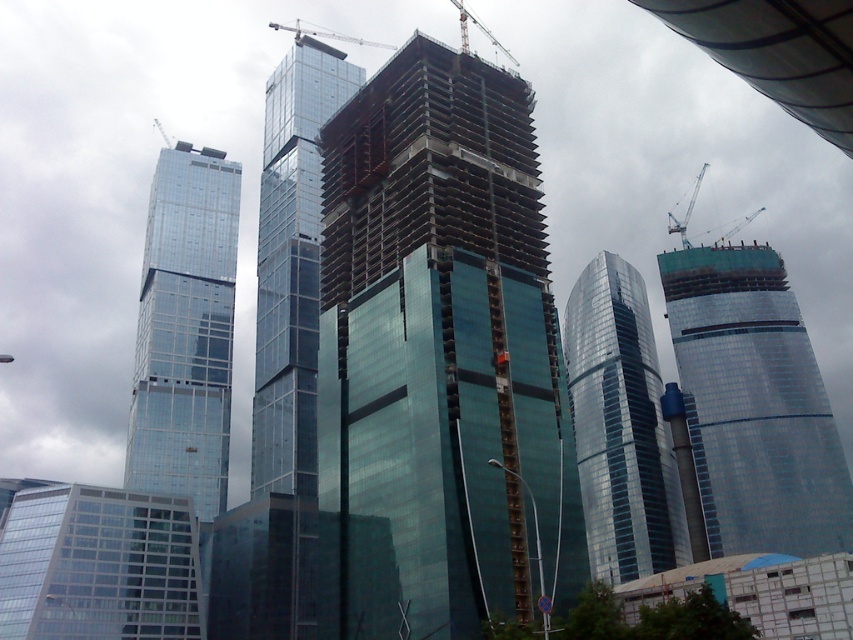
Between green glass building at center and glassy steel skyscraper at center, which one appears on the left side from the viewer's perspective?

From the viewer's perspective, glassy steel skyscraper at center appears more on the left side.

Is green glass building at center shorter than glassy steel skyscraper at center?

Indeed, green glass building at center has a lesser height compared to glassy steel skyscraper at center.

The width and height of the screenshot is (853, 640). Identify the location of green glass building at center. (438, 358).

Is clear glass building at lower left further to the viewer compared to metallic gray crane at upper right?

No.

Is clear glass building at lower left thinner than metallic gray crane at upper right?

No.

Where is `clear glass building at lower left`? This screenshot has height=640, width=853. clear glass building at lower left is located at coordinates [x=97, y=563].

Locate an element on the screen. The height and width of the screenshot is (640, 853). clear glass building at lower left is located at coordinates (97, 563).

Who is shorter, green glass building at center or green glass building at right?

With less height is green glass building at center.

Is green glass building at center thinner than green glass building at right?

Correct, green glass building at center's width is less than green glass building at right's.

I want to click on green glass building at center, so click(x=438, y=358).